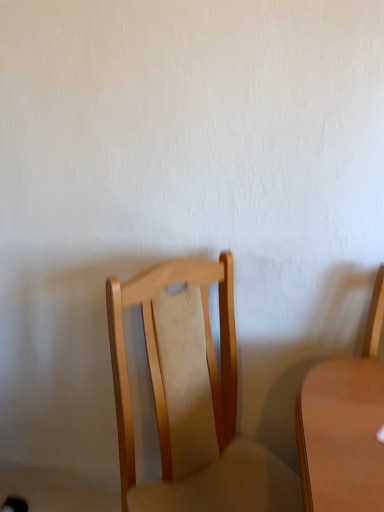
Question: Is light wood chair at center, the 1th chair when ordered from left to right, bigger than light brown wood chair at right, placed as the second chair when sorted from left to right?

Choices:
 (A) yes
 (B) no

Answer: (A)

Question: Can we say light wood chair at center, placed as the second chair when sorted from right to left, lies outside light brown wood chair at right, placed as the second chair when sorted from left to right?

Choices:
 (A) no
 (B) yes

Answer: (B)

Question: Is light wood chair at center, placed as the second chair when sorted from right to left, oriented towards light brown wood chair at right, acting as the 1th chair starting from the right?

Choices:
 (A) no
 (B) yes

Answer: (A)

Question: From a real-world perspective, is light wood chair at center, placed as the second chair when sorted from right to left, located beneath light brown wood chair at right, acting as the 1th chair starting from the right?

Choices:
 (A) no
 (B) yes

Answer: (B)

Question: Considering the relative sizes of light wood chair at center, placed as the second chair when sorted from right to left, and light brown wood chair at right, acting as the 1th chair starting from the right, in the image provided, is light wood chair at center, placed as the second chair when sorted from right to left, smaller than light brown wood chair at right, acting as the 1th chair starting from the right,?

Choices:
 (A) no
 (B) yes

Answer: (A)

Question: Is light wood chair at center, the 1th chair when ordered from left to right, thinner than light brown wood chair at right, acting as the 1th chair starting from the right?

Choices:
 (A) no
 (B) yes

Answer: (A)

Question: Is light brown wood chair at right, placed as the second chair when sorted from left to right, to the left of light wood chair at center, the 1th chair when ordered from left to right, from the viewer's perspective?

Choices:
 (A) no
 (B) yes

Answer: (A)

Question: Considering the relative positions of light brown wood chair at right, acting as the 1th chair starting from the right, and light wood chair at center, placed as the second chair when sorted from right to left, in the image provided, is light brown wood chair at right, acting as the 1th chair starting from the right, to the right of light wood chair at center, placed as the second chair when sorted from right to left, from the viewer's perspective?

Choices:
 (A) yes
 (B) no

Answer: (A)

Question: Can you confirm if light brown wood chair at right, acting as the 1th chair starting from the right, is shorter than light wood chair at center, the 1th chair when ordered from left to right?

Choices:
 (A) yes
 (B) no

Answer: (A)

Question: Does light brown wood chair at right, acting as the 1th chair starting from the right, have a greater width compared to light wood chair at center, placed as the second chair when sorted from right to left?

Choices:
 (A) yes
 (B) no

Answer: (B)

Question: From the image's perspective, would you say light brown wood chair at right, placed as the second chair when sorted from left to right, is shown under light wood chair at center, the 1th chair when ordered from left to right?

Choices:
 (A) yes
 (B) no

Answer: (B)

Question: Are light brown wood chair at right, placed as the second chair when sorted from left to right, and light wood chair at center, placed as the second chair when sorted from right to left, beside each other?

Choices:
 (A) no
 (B) yes

Answer: (A)

Question: Considering the positions of point pos(367,440) and point pos(120,295), is point pos(367,440) closer or farther from the camera than point pos(120,295)?

Choices:
 (A) closer
 (B) farther

Answer: (A)